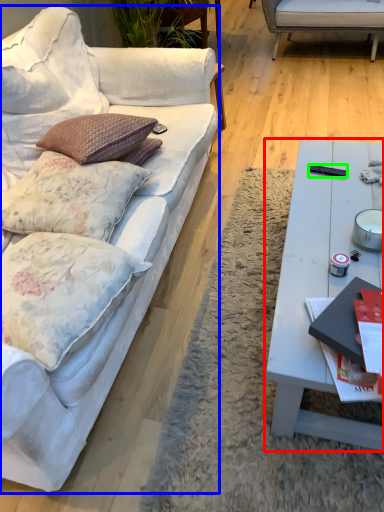
Question: Which object is positioned closest to coffee table (highlighted by a red box)? Select from studio couch (highlighted by a blue box) and remote control (highlighted by a green box).

Choices:
 (A) studio couch
 (B) remote control

Answer: (B)